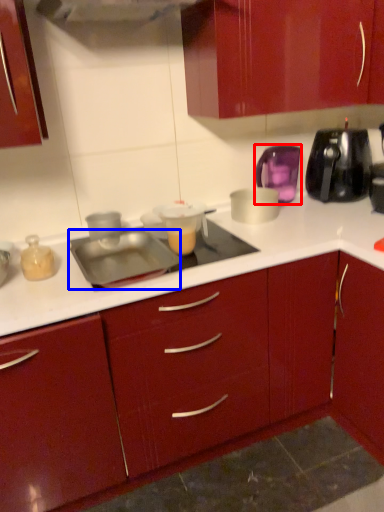
Question: Which point is further to the camera, kitchen appliance (highlighted by a red box) or appliance (highlighted by a blue box)?

Choices:
 (A) kitchen appliance
 (B) appliance

Answer: (A)